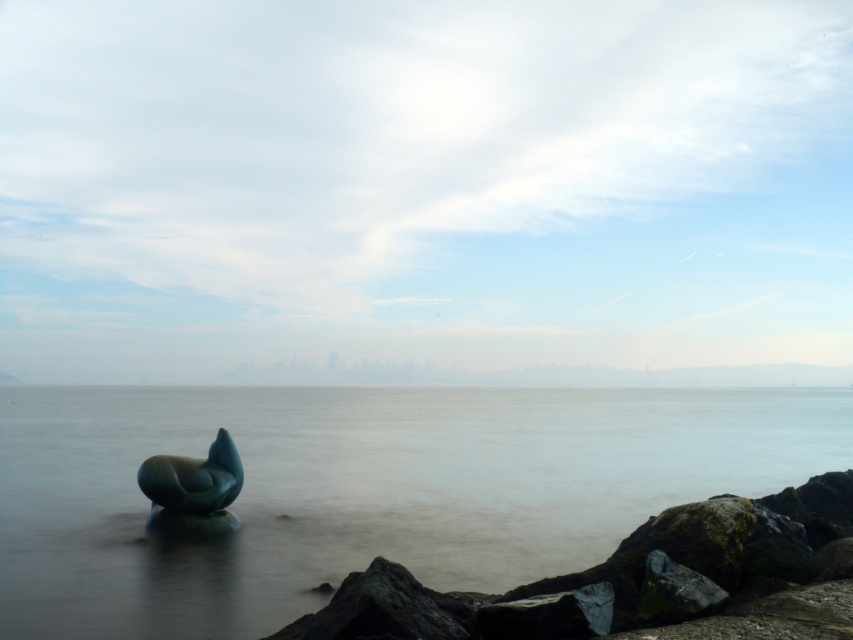
You are standing at the center of the coastal scene and want to walk towards both points. Which point, point (254, 573) or point (172, 518), will you reach first?

Point (254, 573) is in front of point (172, 518), so you will reach point (254, 573) first.

You are a photographer planning to capture the reflection of the distant city skyline in the green metallic water at center and the green polished stone sculpture at center. Which object will show a clearer reflection of the city skyline?

The green metallic water at center will show a clearer reflection of the city skyline because it is much taller than the green polished stone sculpture at center, allowing for a larger and more defined reflection surface.